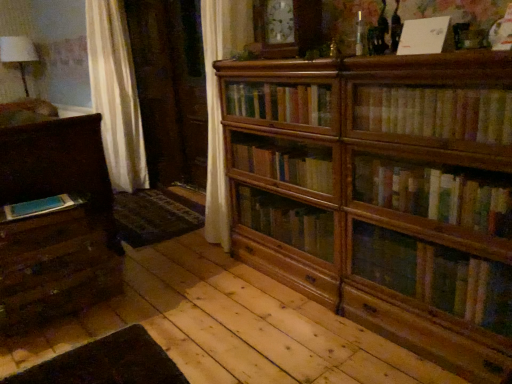
Question: Is wooden drawer at lower left, placed as the second drawer when sorted from bottom to top, facing away from wooden bookcase at center?

Choices:
 (A) no
 (B) yes

Answer: (A)

Question: From the image's perspective, is wooden drawer at lower left, which is the first drawer in top-to-bottom order, beneath wooden bookcase at center?

Choices:
 (A) no
 (B) yes

Answer: (B)

Question: Does wooden drawer at lower left, placed as the second drawer when sorted from bottom to top, have a lesser height compared to wooden bookcase at center?

Choices:
 (A) no
 (B) yes

Answer: (B)

Question: Would you say wooden drawer at lower left, placed as the second drawer when sorted from bottom to top, is outside wooden bookcase at center?

Choices:
 (A) no
 (B) yes

Answer: (B)

Question: Is wooden bookcase at center completely or partially inside wooden drawer at lower left, placed as the second drawer when sorted from bottom to top?

Choices:
 (A) yes
 (B) no

Answer: (B)

Question: From a real-world perspective, is wooden drawer at lower left, placed as the second drawer when sorted from bottom to top, over wooden bookcase at center?

Choices:
 (A) no
 (B) yes

Answer: (A)

Question: Is wooden drawer at lower left, placed as the second drawer when sorted from bottom to top, to the right of blue matte book at lower left, which is the 1th book in bottom-to-top order, from the viewer's perspective?

Choices:
 (A) no
 (B) yes

Answer: (A)

Question: Is wooden drawer at lower left, which is the first drawer in top-to-bottom order, completely or partially outside of blue matte book at lower left, which appears as the 1th book when viewed from the back?

Choices:
 (A) yes
 (B) no

Answer: (A)

Question: Is wooden drawer at lower left, which is the first drawer in top-to-bottom order, aimed at blue matte book at lower left, which is the 1th book in bottom-to-top order?

Choices:
 (A) yes
 (B) no

Answer: (B)

Question: From a real-world perspective, is wooden drawer at lower left, placed as the second drawer when sorted from bottom to top, physically above blue matte book at lower left, which is the third book from top to bottom?

Choices:
 (A) no
 (B) yes

Answer: (A)

Question: From a real-world perspective, is wooden drawer at lower left, which is the first drawer in top-to-bottom order, beneath blue matte book at lower left, the first book when ordered from left to right?

Choices:
 (A) no
 (B) yes

Answer: (B)

Question: Is wooden drawer at lower left, which is the first drawer in top-to-bottom order, shorter than blue matte book at lower left, which is the 1th book in bottom-to-top order?

Choices:
 (A) no
 (B) yes

Answer: (A)

Question: Is white paper at upper center, which ranks as the second book in back-to-front order, thinner than wooden drawer at lower left, placed as the second drawer when sorted from bottom to top?

Choices:
 (A) no
 (B) yes

Answer: (B)